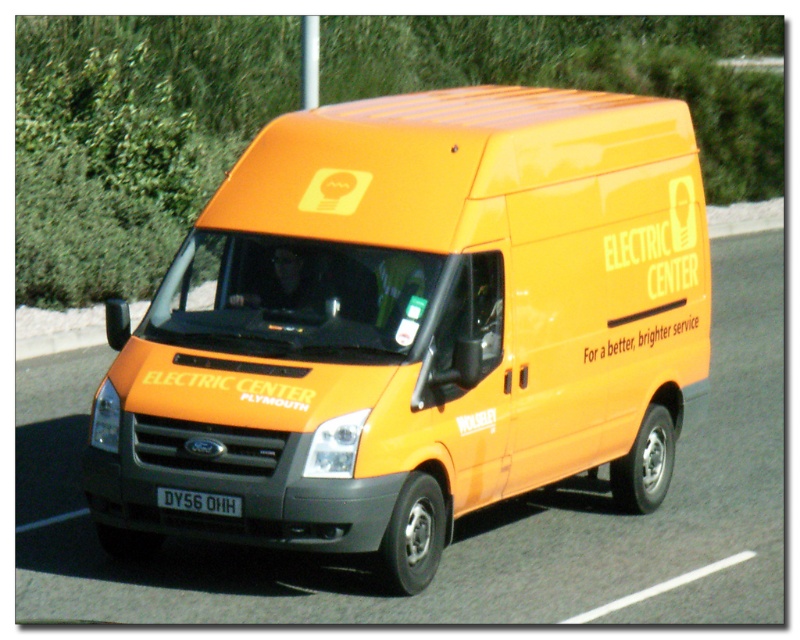
Question: Is the position of orange matte van at center more distant than that of black plastic license plate at center?

Choices:
 (A) yes
 (B) no

Answer: (B)

Question: Does orange matte van at center appear on the right side of black plastic license plate at center?

Choices:
 (A) no
 (B) yes

Answer: (B)

Question: Which object appears closest to the camera in this image?

Choices:
 (A) black plastic license plate at center
 (B) orange matte van at center

Answer: (B)

Question: Does orange matte van at center appear under black plastic license plate at center?

Choices:
 (A) yes
 (B) no

Answer: (B)